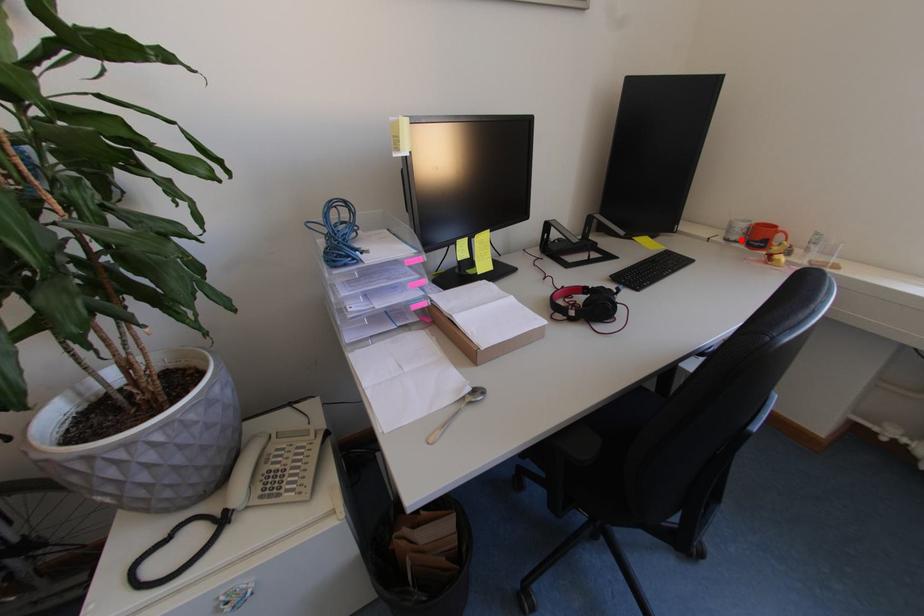
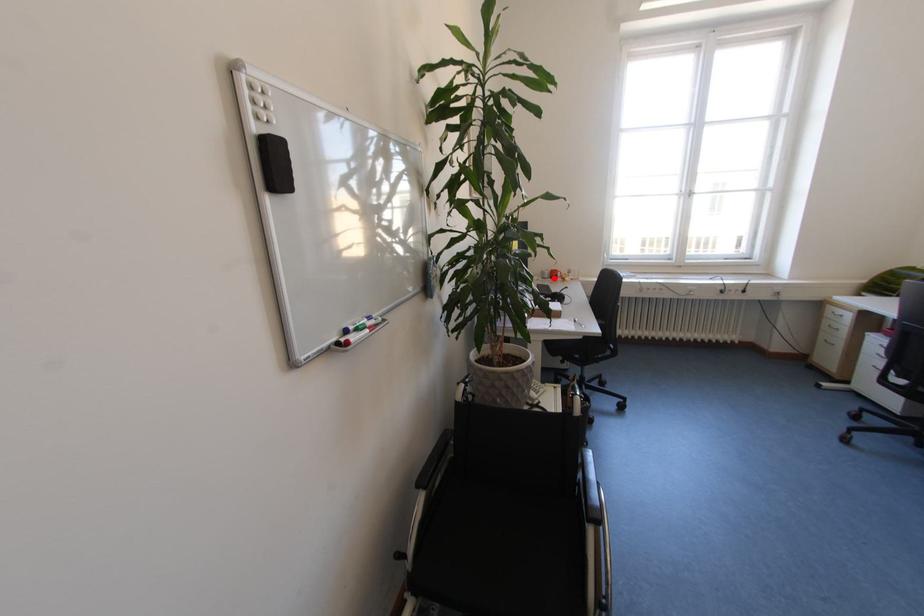
I am providing you with two images of the same scene from different viewpoints. A red point is marked on the first image and another point is marked on the second image. Is the red point in image1 aligned with the point shown in image2?

Yes